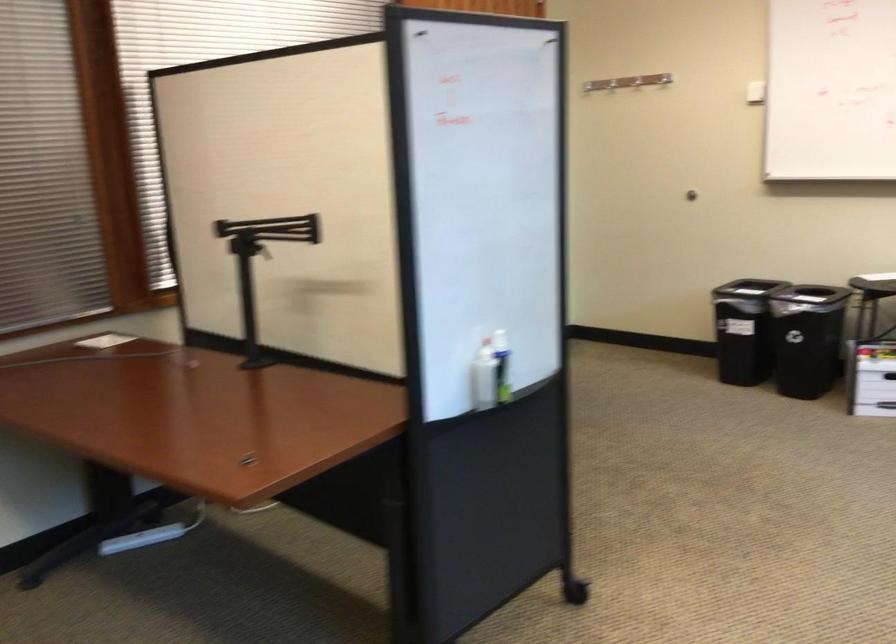
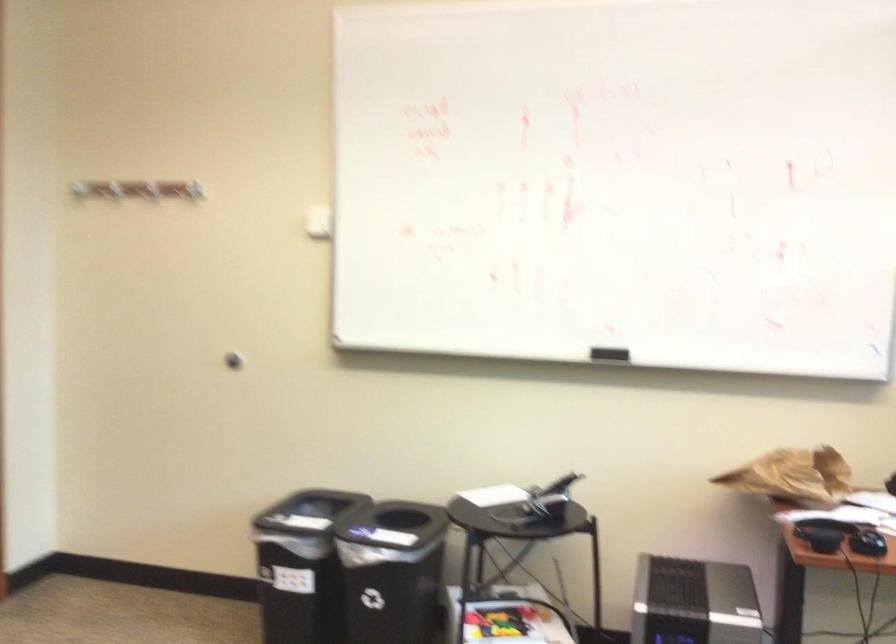
Locate, in the second image, the point that corresponds to point 674,89 in the first image.

(317, 222)